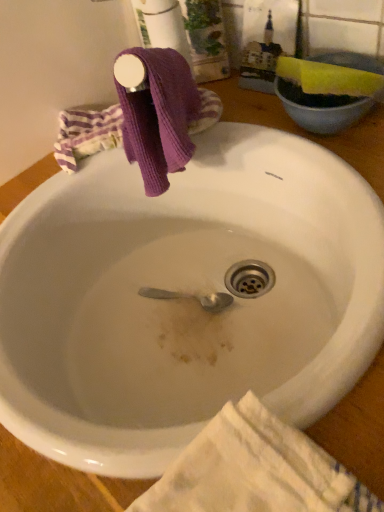
Question: From the image's perspective, is white glossy sink at upper center located above or below white textured towel at lower right?

Choices:
 (A) above
 (B) below

Answer: (A)

Question: Considering the positions of point [x=198, y=208] and point [x=306, y=453], is point [x=198, y=208] closer or farther from the camera than point [x=306, y=453]?

Choices:
 (A) closer
 (B) farther

Answer: (B)

Question: Is white glossy sink at upper center wider or thinner than white textured towel at lower right?

Choices:
 (A) thin
 (B) wide

Answer: (B)

Question: Based on their sizes in the image, would you say white textured towel at lower right is bigger or smaller than white glossy sink at upper center?

Choices:
 (A) small
 (B) big

Answer: (A)

Question: From the image's perspective, is white textured towel at lower right located above or below white glossy sink at upper center?

Choices:
 (A) below
 (B) above

Answer: (A)

Question: Is white textured towel at lower right in front of or behind white glossy sink at upper center in the image?

Choices:
 (A) front
 (B) behind

Answer: (A)

Question: Considering the positions of white textured towel at lower right and white glossy sink at upper center in the image, is white textured towel at lower right wider or thinner than white glossy sink at upper center?

Choices:
 (A) thin
 (B) wide

Answer: (A)